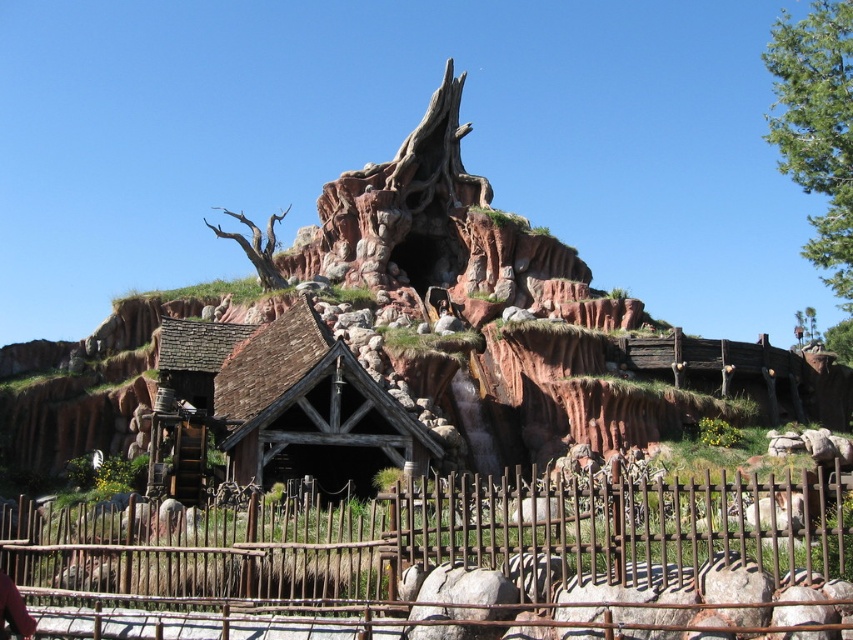
You are a visitor at this fantasy theme park and want to take a photo of the green leafy tree at upper right. However, you notice the rustic wood fence at lower center might block your view. Can you still see the tree clearly from where you are standing?

The rustic wood fence at lower center is shorter than the green leafy tree at upper right, so you can still see the tree clearly over the fence.

You are standing at the base of the rocky cliff in the image. You see a rustic wood fence at lower center marked by point (453,561). Which direction should you walk to reach the wooden building with the steeply pitched roof?

To reach the wooden building with the steeply pitched roof from the rustic wood fence at lower center marked by point (453,561), you should walk towards the structure in the foreground since the wooden building is positioned in front of the rocky cliff and the fence is located at its base.